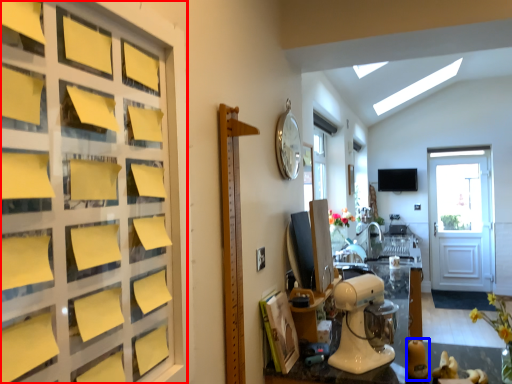
Question: Which point is closer to the camera, door (highlighted by a red box) or toy (highlighted by a blue box)?

Choices:
 (A) door
 (B) toy

Answer: (A)